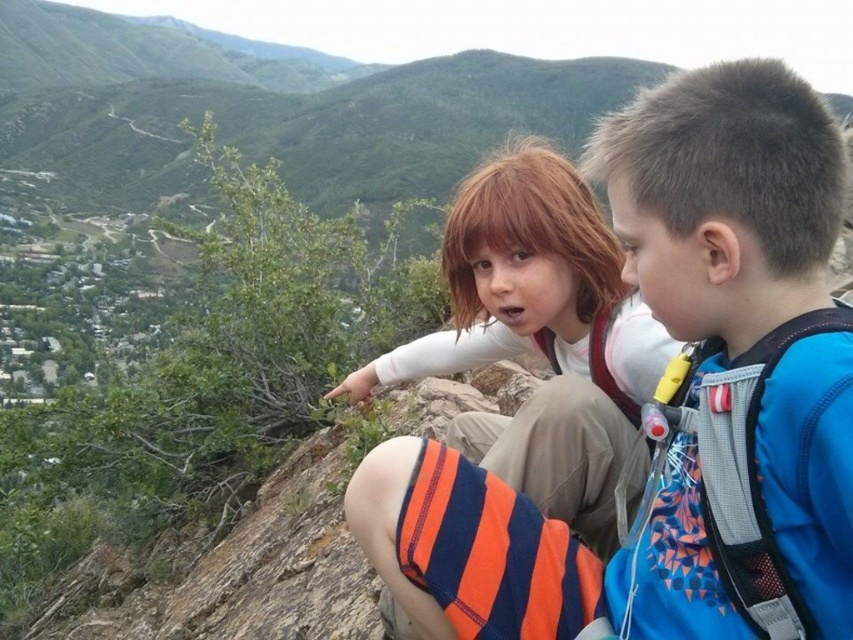
You are a photographer trying to capture a candid shot of the two children in the scene. You notice the blue fabric backpack at upper right and the white cotton shirt at center. Which object takes up more visual space in the image?

The white cotton shirt at center occupies more visual space than the blue fabric backpack at upper right according to the description.

You are a photographer trying to capture both the blue fabric backpack at upper right and the white cotton shirt at center in a single shot. Based on their positions, which object should you adjust your camera to focus on first to ensure both are in frame?

You should focus on the white cotton shirt at center first because the blue fabric backpack at upper right is to the right of it, so adjusting the frame to include both would require accounting for their horizontal positioning.